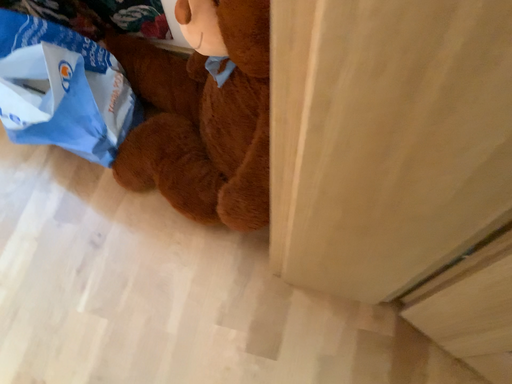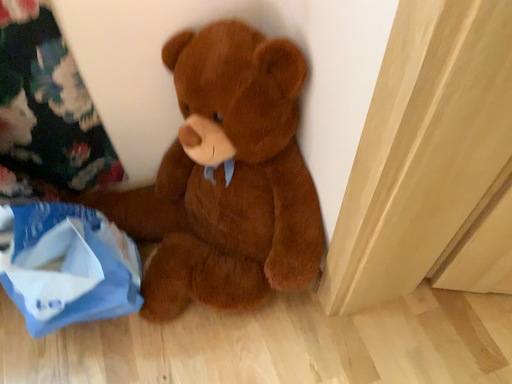
Question: Which way did the camera rotate in the video?

Choices:
 (A) rotated upward
 (B) rotated downward

Answer: (A)